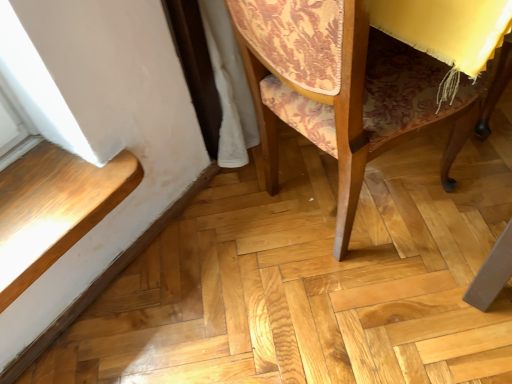
Question: Considering the relative sizes of wooden floor at lower left and patterned fabric chair at center in the image provided, is wooden floor at lower left bigger than patterned fabric chair at center?

Choices:
 (A) no
 (B) yes

Answer: (A)

Question: Is wooden floor at lower left positioned behind patterned fabric chair at center?

Choices:
 (A) yes
 (B) no

Answer: (A)

Question: Can you confirm if wooden floor at lower left is wider than patterned fabric chair at center?

Choices:
 (A) no
 (B) yes

Answer: (A)

Question: Is wooden floor at lower left positioned with its back to patterned fabric chair at center?

Choices:
 (A) no
 (B) yes

Answer: (A)

Question: From a real-world perspective, is wooden floor at lower left on patterned fabric chair at center?

Choices:
 (A) no
 (B) yes

Answer: (A)

Question: Does wooden floor at lower left touch patterned fabric chair at center?

Choices:
 (A) no
 (B) yes

Answer: (A)

Question: Is patterned fabric chair at center not inside wooden floor at lower left?

Choices:
 (A) no
 (B) yes

Answer: (B)

Question: Is patterned fabric chair at center to the right of wooden floor at lower left from the viewer's perspective?

Choices:
 (A) no
 (B) yes

Answer: (B)

Question: Does patterned fabric chair at center have a greater width compared to wooden floor at lower left?

Choices:
 (A) no
 (B) yes

Answer: (B)

Question: Is patterned fabric chair at center shorter than wooden floor at lower left?

Choices:
 (A) yes
 (B) no

Answer: (B)

Question: Considering the relative sizes of patterned fabric chair at center and wooden floor at lower left in the image provided, is patterned fabric chair at center smaller than wooden floor at lower left?

Choices:
 (A) yes
 (B) no

Answer: (B)

Question: Is patterned fabric chair at center oriented away from wooden floor at lower left?

Choices:
 (A) yes
 (B) no

Answer: (A)

Question: Is patterned fabric chair at center taller or shorter than wooden floor at lower left?

Choices:
 (A) tall
 (B) short

Answer: (A)